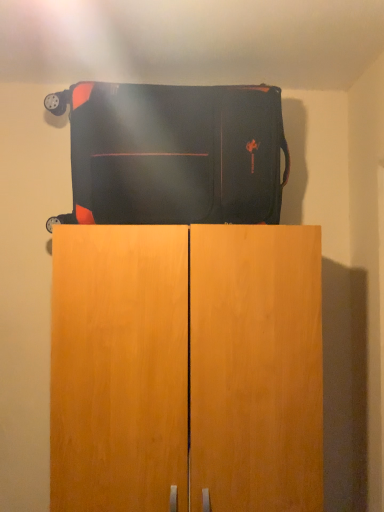
What do you see at coordinates (173, 154) in the screenshot? The width and height of the screenshot is (384, 512). I see `matte black suitcase at center` at bounding box center [173, 154].

Measure the distance between point [235,149] and camera.

A distance of 1.35 meters exists between point [235,149] and camera.

What is the approximate width of matte black suitcase at center?

The width of matte black suitcase at center is 15.52 inches.

Image resolution: width=384 pixels, height=512 pixels. In order to click on matte black suitcase at center in this screenshot , I will do `click(173, 154)`.

In order to click on matte black suitcase at center in this screenshot , I will do `click(173, 154)`.